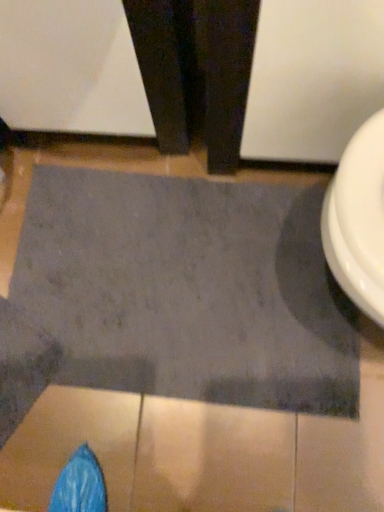
Locate an element on the screen. This screenshot has height=512, width=384. free space in front of dark gray carpet at center is located at coordinates point(202,451).